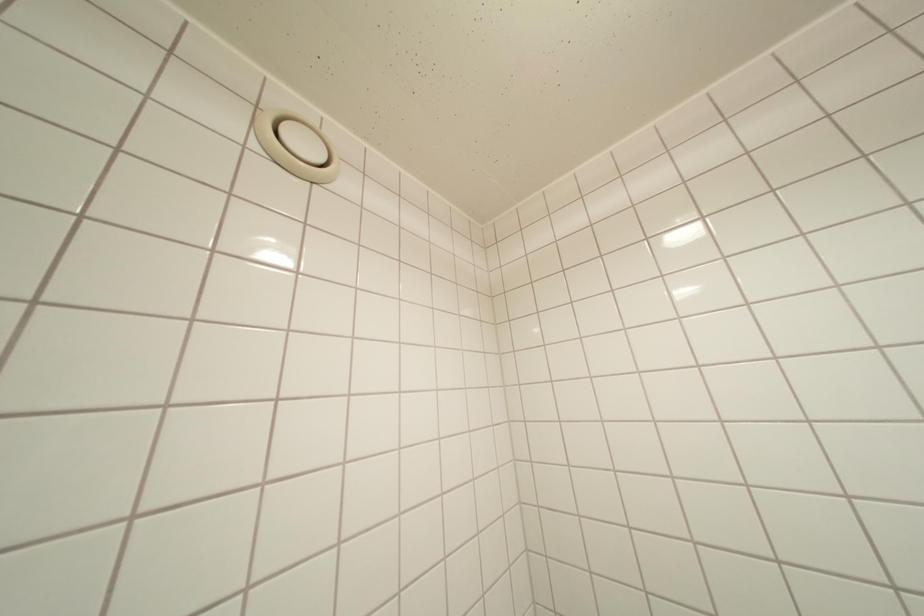
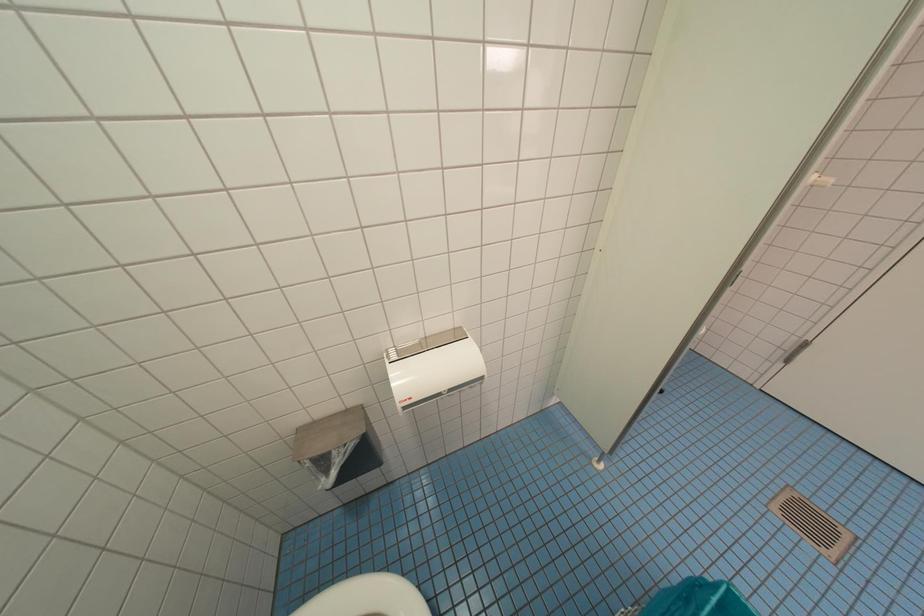
How did the camera likely rotate?

The camera rotated toward right-down.